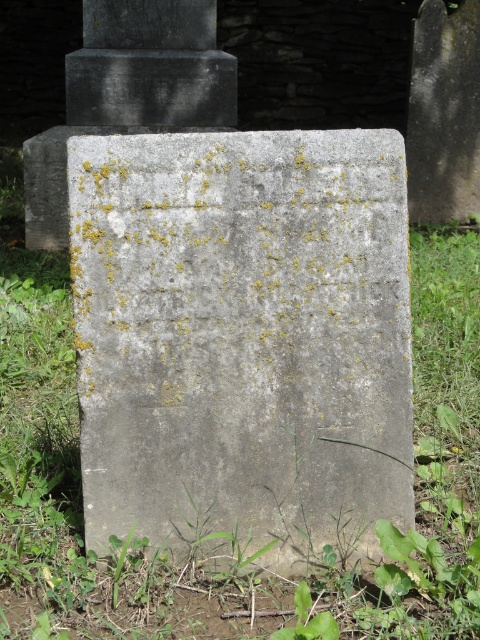
Question: Does gray stone gravestone at center have a greater width compared to green leafy weed at lower center?

Choices:
 (A) no
 (B) yes

Answer: (B)

Question: Is gray stone gravestone at center to the right of green leafy weed at lower center from the viewer's perspective?

Choices:
 (A) yes
 (B) no

Answer: (B)

Question: Can you confirm if gray stone gravestone at center is smaller than green leafy weed at lower center?

Choices:
 (A) no
 (B) yes

Answer: (A)